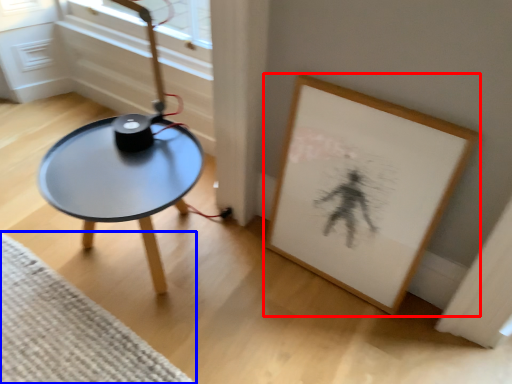
Question: Which object is further to the camera taking this photo, picture frame (highlighted by a red box) or mat (highlighted by a blue box)?

Choices:
 (A) picture frame
 (B) mat

Answer: (B)